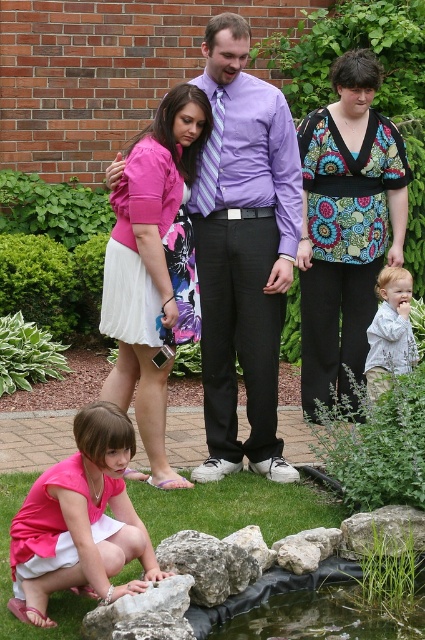
Which is behind, point (139, 628) or point (394, 333)?

The point (394, 333) is more distant.

Is gray rough rock at lower left thinner than light gray textured shirt at lower right?

No, gray rough rock at lower left is not thinner than light gray textured shirt at lower right.

The image size is (425, 640). Identify the location of gray rough rock at lower left. (144, 612).

Who is more distant from viewer, (84, 472) or (288, 557)?

The point (288, 557) is behind.

Is pink matte dress at lower left smaller than smooth gray rock at center?

Actually, pink matte dress at lower left might be larger than smooth gray rock at center.

Where is `pink matte dress at lower left`? pink matte dress at lower left is located at coordinates (81, 522).

Is matte purple shirt at center behind floral fabric blouse at center?

No, it is in front of floral fabric blouse at center.

Does matte purple shirt at center appear over floral fabric blouse at center?

Actually, matte purple shirt at center is below floral fabric blouse at center.

Is point (278, 256) farther from viewer compared to point (328, 243)?

No, (278, 256) is closer to viewer.

Where is `matte purple shirt at center`? The height and width of the screenshot is (640, 425). matte purple shirt at center is located at coordinates (243, 250).